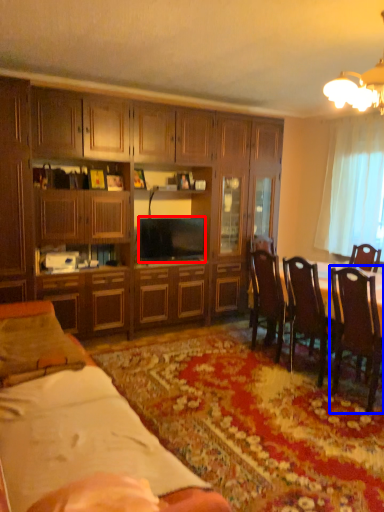
Question: Which object appears farthest to the camera in this image, television (highlighted by a red box) or chair (highlighted by a blue box)?

Choices:
 (A) television
 (B) chair

Answer: (A)